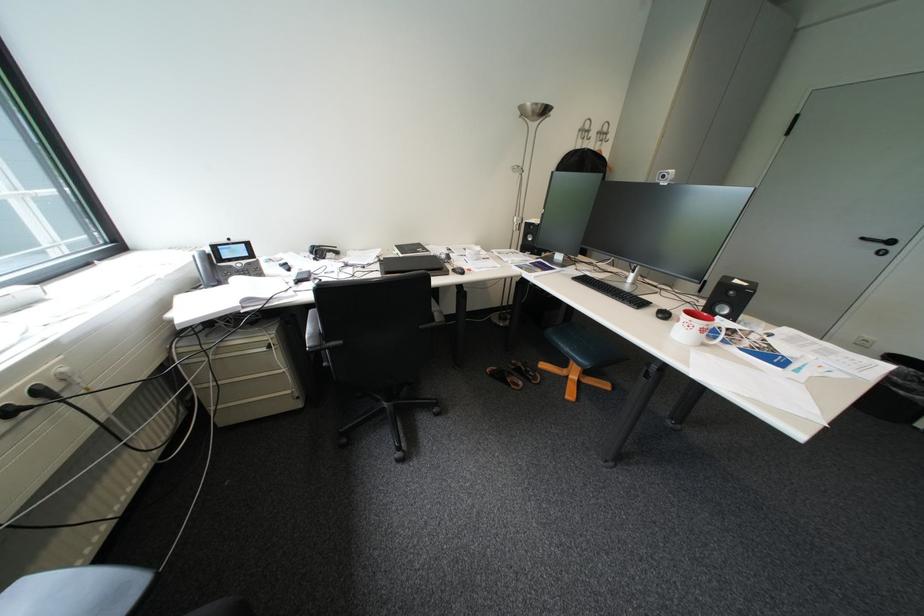
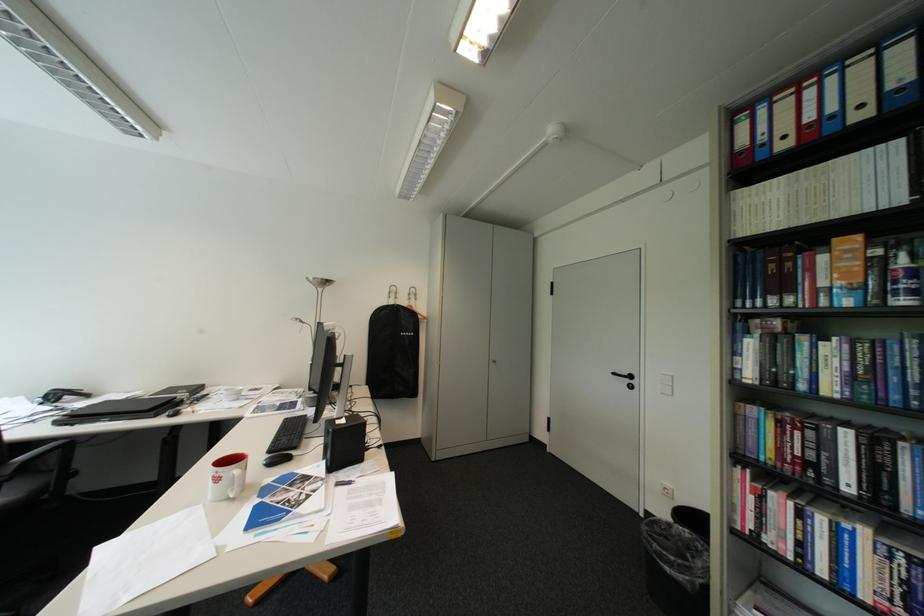
Question: I am providing you with two images of the same scene from different viewpoints. Please identify which objects are invisible in image2.

Choices:
 (A) silver coat hook
 (B) yellow glass
 (C) red binder pull-hole
 (D) brown sandal

Answer: (D)